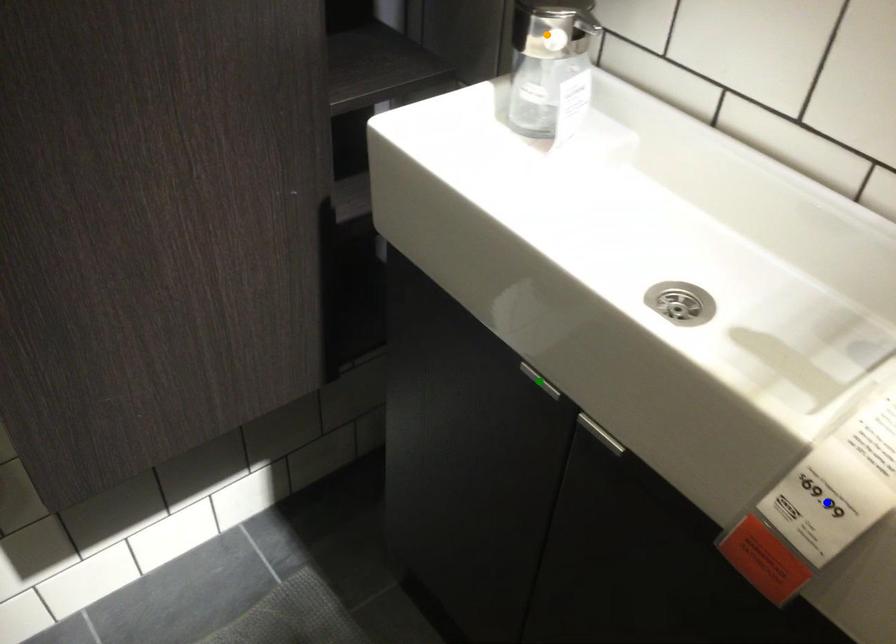
Order these from farthest to nearest:
blue point, orange point, green point

orange point < green point < blue point